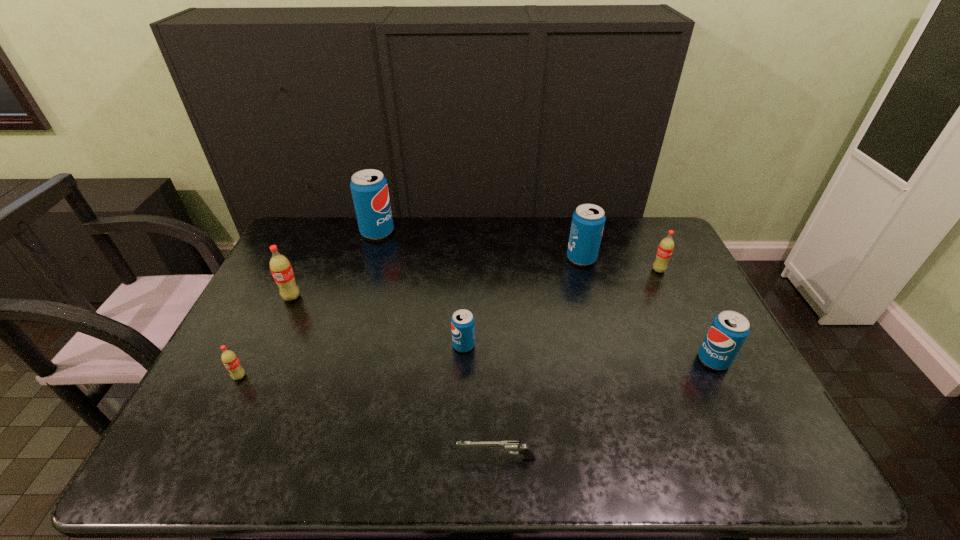
You are a GUI agent. You are given a task and a screenshot of the screen. Output one action in this format:
    pyautogui.click(x=<x>, y=<y>)
    Task: Click on the farthest soda
    This screenshot has height=540, width=960.
    Given the screenshot: What is the action you would take?
    pyautogui.click(x=369, y=188)

The width and height of the screenshot is (960, 540). In order to click on the farthest object in this screenshot , I will do `click(369, 188)`.

Locate an element on the screen. This screenshot has height=540, width=960. the second biggest blue soda can is located at coordinates 588,220.

The height and width of the screenshot is (540, 960). What are the coordinates of `the second blue soda can from right to left` in the screenshot? It's located at 588,220.

You are a GUI agent. You are given a task and a screenshot of the screen. Output one action in this format:
    pyautogui.click(x=<x>, y=<y>)
    Task: Click on the fourth nearest soda
    Image resolution: width=960 pixels, height=540 pixels.
    Given the screenshot: What is the action you would take?
    (x=280, y=267)

I want to click on the fifth nearest object, so click(x=280, y=267).

Where is `the rightmost red soda`? The width and height of the screenshot is (960, 540). the rightmost red soda is located at coordinates (666, 246).

The height and width of the screenshot is (540, 960). I want to click on the farthest red soda, so click(x=666, y=246).

You are a GUI agent. You are given a task and a screenshot of the screen. Output one action in this format:
    pyautogui.click(x=<x>, y=<y>)
    Task: Click on the rightmost blue soda can
    
    Given the screenshot: What is the action you would take?
    pyautogui.click(x=729, y=329)

The image size is (960, 540). I want to click on the second blue soda can from left to right, so click(462, 322).